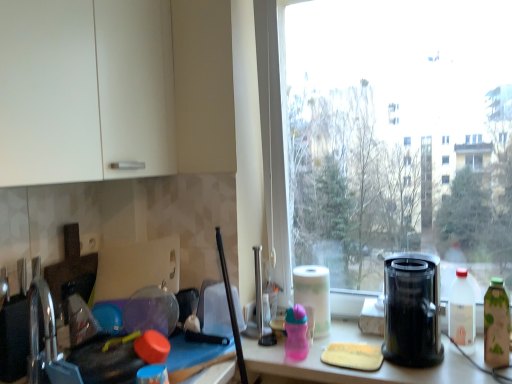
Where is `black plastic juicer at right`? This screenshot has height=384, width=512. black plastic juicer at right is located at coordinates (412, 310).

In order to click on transparent glass window at center in this screenshot , I will do `click(382, 133)`.

You are a GUI agent. You are given a task and a screenshot of the screen. Output one action in this format:
    pyautogui.click(x=<x>, y=<y>)
    Task: Click on the white plastic bottle at right, arranged as the second bottle when viewed from the left
    The image size is (512, 384).
    Given the screenshot: What is the action you would take?
    pyautogui.click(x=462, y=312)

The height and width of the screenshot is (384, 512). In order to click on white paper at window in this screenshot , I will do `click(314, 294)`.

Measure the distance between point (298, 342) and camera.

Point (298, 342) is 4.64 feet from camera.

This screenshot has width=512, height=384. What are the coordinates of `green matte bottle at right, which is the 3th bottle in left-to-right order` in the screenshot? It's located at (496, 324).

Where is `black plastic juicer at right`? This screenshot has width=512, height=384. black plastic juicer at right is located at coordinates (412, 310).

Considering the sizes of objects white paper at window and black plastic juicer at right in the image provided, who is thinner, white paper at window or black plastic juicer at right?

Thinner between the two is white paper at window.

Which is more to the left, white paper at window or black plastic juicer at right?

Positioned to the left is white paper at window.

Are white paper at window and black plastic juicer at right located far from each other?

white paper at window is actually quite close to black plastic juicer at right.

Looking at this image, is white paper at window facing towards black plastic juicer at right?

No, white paper at window is not turned towards black plastic juicer at right.

From a real-world perspective, which is physically above, green matte bottle at right, which is the 1th bottle from right to left, or pink plastic sippy cup at center, the first bottle when ordered from left to right?

green matte bottle at right, which is the 1th bottle from right to left, from a real-world perspective.

Which object is more forward, green matte bottle at right, which is the 3th bottle in left-to-right order, or pink plastic sippy cup at center, the first bottle when ordered from left to right?

green matte bottle at right, which is the 3th bottle in left-to-right order, is closer to the camera.

Does green matte bottle at right, which is the 1th bottle from right to left, turn towards pink plastic sippy cup at center, which appears as the third bottle when viewed from the right?

No, green matte bottle at right, which is the 1th bottle from right to left, is not turned towards pink plastic sippy cup at center, which appears as the third bottle when viewed from the right.

Which of these two, green matte bottle at right, which is the 1th bottle from right to left, or pink plastic sippy cup at center, which appears as the third bottle when viewed from the right, is thinner?

green matte bottle at right, which is the 1th bottle from right to left.

From a real-world perspective, is pink plastic sippy cup at center, which appears as the third bottle when viewed from the right, located beneath black plastic juicer at right?

Yes.

How many degrees apart are the facing directions of pink plastic sippy cup at center, the first bottle when ordered from left to right, and black plastic juicer at right?

The facing directions of pink plastic sippy cup at center, the first bottle when ordered from left to right, and black plastic juicer at right are 1.5 degrees apart.

Between point (298, 329) and point (430, 265), which one is positioned in front?

The point (430, 265) is in front.

Is pink plastic sippy cup at center, which appears as the third bottle when viewed from the right, shorter than black plastic juicer at right?

Yes, pink plastic sippy cup at center, which appears as the third bottle when viewed from the right, is shorter than black plastic juicer at right.

How different are the orientations of green matte bottle at right, which is the 1th bottle from right to left, and black plastic juicer at right in degrees?

0.242 degrees.

Based on their positions, is green matte bottle at right, which is the 1th bottle from right to left, located to the left or right of black plastic juicer at right?

green matte bottle at right, which is the 1th bottle from right to left, is to the right of black plastic juicer at right.

Where is `kitchen appliance above the green matte bottle at right, which is the 1th bottle from right to left (from a real-world perspective)`? kitchen appliance above the green matte bottle at right, which is the 1th bottle from right to left (from a real-world perspective) is located at coordinates (412, 310).

Which object is more forward, green matte bottle at right, which is the 1th bottle from right to left, or black plastic juicer at right?

black plastic juicer at right is closer to the camera.

Which is correct: transparent glass window at center is inside white paper at window, or outside of it?

transparent glass window at center is not enclosed by white paper at window.

Can you confirm if transparent glass window at center is shorter than white paper at window?

No.

Considering the points (398, 165) and (298, 283), which point is behind, point (398, 165) or point (298, 283)?

The point (398, 165) is more distant.

Which object is further away from the camera taking this photo, transparent glass window at center or white plastic bottle at right, which is counted as the 2th bottle, starting from the right?

Positioned behind is white plastic bottle at right, which is counted as the 2th bottle, starting from the right.

From a real-world perspective, is transparent glass window at center below white plastic bottle at right, which is counted as the 2th bottle, starting from the right?

No.

Can you tell me how much transparent glass window at center and white plastic bottle at right, which is counted as the 2th bottle, starting from the right, differ in facing direction?

The facing directions of transparent glass window at center and white plastic bottle at right, which is counted as the 2th bottle, starting from the right, are 1.54 degrees apart.

From the image's perspective, is transparent glass window at center positioned above or below white plastic bottle at right, arranged as the second bottle when viewed from the left?

transparent glass window at center is above white plastic bottle at right, arranged as the second bottle when viewed from the left.

Are transparent glass window at center and black plastic juicer at right far apart?

transparent glass window at center is positioned a significant distance from black plastic juicer at right.

From the image's perspective, which one is positioned lower, transparent glass window at center or black plastic juicer at right?

From the image's view, black plastic juicer at right is below.

From the picture: Between transparent glass window at center and black plastic juicer at right, which one has larger size?

transparent glass window at center is bigger.

Is transparent glass window at center positioned beyond the bounds of black plastic juicer at right?

transparent glass window at center is positioned outside black plastic juicer at right.

Where is `paper towel below the black plastic juicer at right (from the image's perspective)`? The height and width of the screenshot is (384, 512). paper towel below the black plastic juicer at right (from the image's perspective) is located at coordinates (314, 294).

In order to click on bottle directly beneath the green matte bottle at right, which is the 3th bottle in left-to-right order (from a real-world perspective) in this screenshot , I will do `click(296, 333)`.

Based on their spatial positions, is transparent glass window at center or pink plastic sippy cup at center, the first bottle when ordered from left to right, further from black plastic juicer at right?

transparent glass window at center lies further to black plastic juicer at right than the other object.

When comparing their distances from pink plastic sippy cup at center, which appears as the third bottle when viewed from the right, does green matte bottle at right, which is the 3th bottle in left-to-right order, or white plastic bottle at right, which is counted as the 2th bottle, starting from the right, seem closer?

white plastic bottle at right, which is counted as the 2th bottle, starting from the right.

Based on their spatial positions, is white paper at window or transparent glass window at center further from pink plastic sippy cup at center, which appears as the third bottle when viewed from the right?

Among the two, transparent glass window at center is located further to pink plastic sippy cup at center, which appears as the third bottle when viewed from the right.

Considering their positions, is white paper at window positioned closer to transparent glass window at center than white plastic bottle at right, arranged as the second bottle when viewed from the left?

The object closer to transparent glass window at center is white paper at window.

When comparing their distances from black plastic juicer at right, does pink plastic sippy cup at center, the first bottle when ordered from left to right, or transparent glass window at center seem further?

The object further to black plastic juicer at right is transparent glass window at center.

Looking at the image, which one is located closer to green matte bottle at right, which is the 1th bottle from right to left, white plastic bottle at right, which is counted as the 2th bottle, starting from the right, or transparent glass window at center?

Among the two, white plastic bottle at right, which is counted as the 2th bottle, starting from the right, is located nearer to green matte bottle at right, which is the 1th bottle from right to left.

Considering their positions, is white paper at window positioned further to transparent glass window at center than green matte bottle at right, which is the 3th bottle in left-to-right order?

green matte bottle at right, which is the 3th bottle in left-to-right order, is positioned further to the anchor transparent glass window at center.

When comparing their distances from white plastic bottle at right, which is counted as the 2th bottle, starting from the right, does green matte bottle at right, which is the 1th bottle from right to left, or pink plastic sippy cup at center, the first bottle when ordered from left to right, seem further?

pink plastic sippy cup at center, the first bottle when ordered from left to right.

I want to click on paper towel between pink plastic sippy cup at center, the first bottle when ordered from left to right, and green matte bottle at right, which is the 1th bottle from right to left, so click(314, 294).

The height and width of the screenshot is (384, 512). In order to click on kitchen appliance between pink plastic sippy cup at center, the first bottle when ordered from left to right, and green matte bottle at right, which is the 3th bottle in left-to-right order in this screenshot , I will do `click(412, 310)`.

I want to click on paper towel between pink plastic sippy cup at center, the first bottle when ordered from left to right, and black plastic juicer at right from left to right, so click(x=314, y=294).

Where is `paper towel between pink plastic sippy cup at center, which appears as the third bottle when viewed from the right, and white plastic bottle at right, which is counted as the 2th bottle, starting from the right`? This screenshot has width=512, height=384. paper towel between pink plastic sippy cup at center, which appears as the third bottle when viewed from the right, and white plastic bottle at right, which is counted as the 2th bottle, starting from the right is located at coordinates (314, 294).